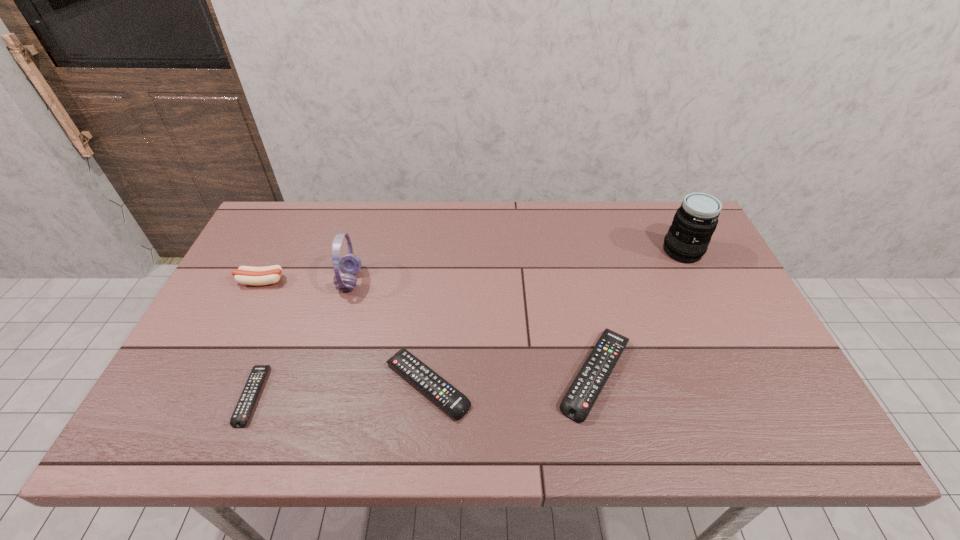
Select which remote control appears as the second closest to the shortest remote control. Please provide its 2D coordinates. Your answer should be formatted as a tuple, i.e. [(x, y)], where the tuple contains the x and y coordinates of a point satisfying the conditions above.

[(578, 401)]

What are the coordinates of `vacant space that satisfies the following two spatial constraints: 1. on the headband and ear cups of the third object from left to right; 2. on the back side of the rightmost remote control` in the screenshot? It's located at (323, 374).

This screenshot has width=960, height=540. I want to click on free point that satisfies the following two spatial constraints: 1. on the headband and ear cups of the fifth tallest object; 2. on the left side of the third object from left to right, so click(x=320, y=384).

In order to click on vacant space that satisfies the following two spatial constraints: 1. on the back side of the second shortest object; 2. on the right side of the telephoto lens in this screenshot , I will do `click(440, 251)`.

At what (x,y) coordinates should I click in order to perform the action: click on free space that satisfies the following two spatial constraints: 1. on the headband and ear cups of the fourth object from right to left; 2. on the left side of the second remote control from right to left. Please return your answer as a coordinate pair (x, y). Looking at the image, I should click on (320, 384).

I want to click on vacant point that satisfies the following two spatial constraints: 1. on the back side of the fifth tallest object; 2. on the headband and ear cups of the third object from left to right, so click(x=438, y=281).

I want to click on free location that satisfies the following two spatial constraints: 1. on the back side of the rightmost remote control; 2. on the headband and ear cups of the fifth shortest object, so click(x=576, y=281).

At what (x,y) coordinates should I click in order to perform the action: click on free space that satisfies the following two spatial constraints: 1. on the headband and ear cups of the fifth shortest object; 2. on the back side of the second object from right to left. Please return your answer as a coordinate pair (x, y). The width and height of the screenshot is (960, 540). Looking at the image, I should click on coord(323,374).